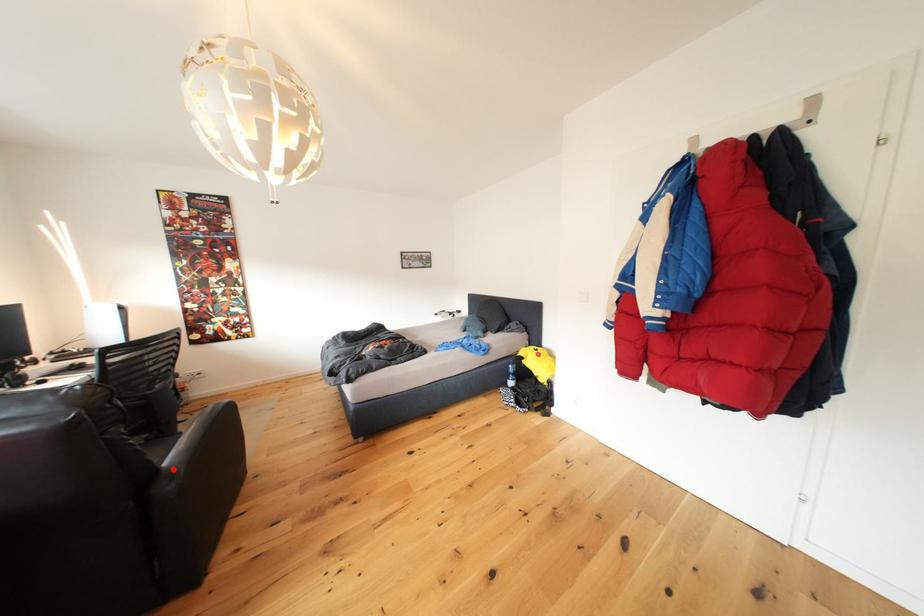
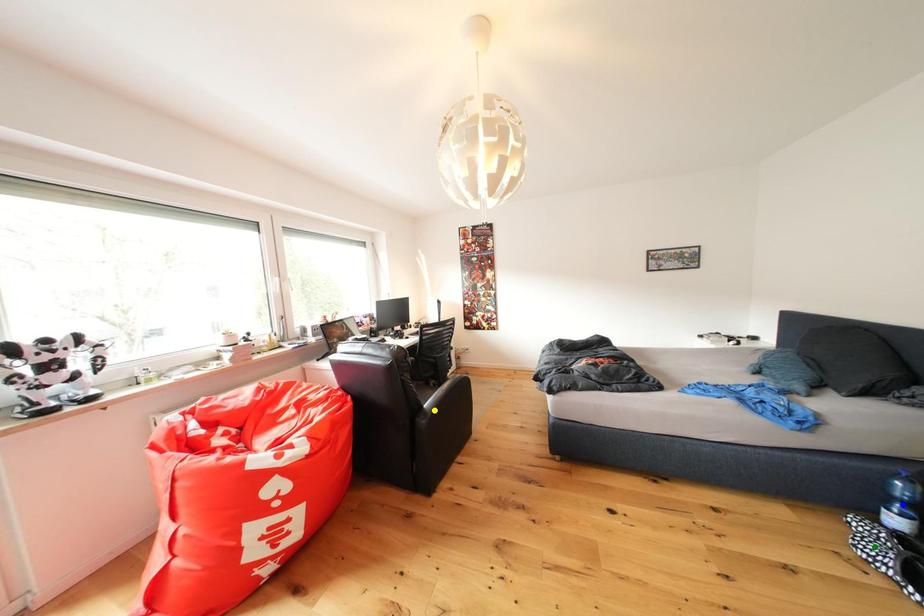
Question: I am providing you with two images of the same scene from different viewpoints. A red point is marked on the first image. You are given multiple points on the second image. Which point in image 2 represents the same 3d spot as the red point in image 1?

Choices:
 (A) blue point
 (B) green point
 (C) yellow point

Answer: (C)